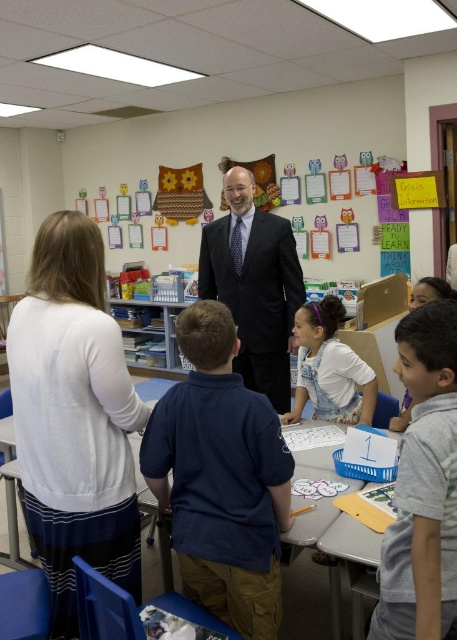
Question: Which of these objects is positioned farthest from the white sweater at left?

Choices:
 (A) gray cotton shirt at lower right
 (B) dark blue shirt at center
 (C) black suit at center
 (D) white cotton shirt at center

Answer: (C)

Question: Which is farther from the gray cotton shirt at lower right?

Choices:
 (A) dark blue shirt at center
 (B) white cotton shirt at center

Answer: (B)

Question: Does white sweater at left appear over white cotton shirt at center?

Choices:
 (A) no
 (B) yes

Answer: (A)

Question: Is dark blue shirt at center in front of gray cotton shirt at lower right?

Choices:
 (A) no
 (B) yes

Answer: (A)

Question: Which point is closer to the camera?

Choices:
 (A) dark blue shirt at center
 (B) white sweater at left

Answer: (B)

Question: Is the position of gray cotton shirt at lower right less distant than that of black suit at center?

Choices:
 (A) no
 (B) yes

Answer: (B)